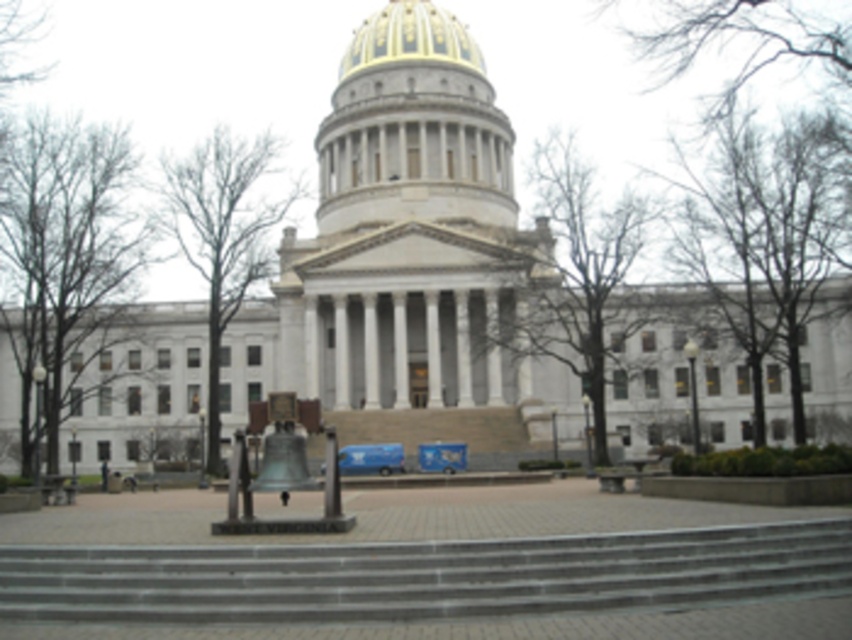
Which is in front, point (214, 179) or point (1, 76)?

Point (214, 179)

Is the position of green leafless tree at center more distant than that of smooth brown bark at left?

That is False.

What are the coordinates of `green leafless tree at center` in the screenshot? It's located at (223, 236).

Find the location of `green leafless tree at center`. green leafless tree at center is located at coordinates (223, 236).

Does brown leafless tree at left appear on the left side of green leafless tree at center?

Correct, you'll find brown leafless tree at left to the left of green leafless tree at center.

What are the coordinates of `brown leafless tree at left` in the screenshot? It's located at (64, 259).

What are the coordinates of `brown leafless tree at left` in the screenshot? It's located at (64, 259).

Can you confirm if gray concrete stairs at center is thinner than smooth brown bark at left?

Incorrect, gray concrete stairs at center's width is not less than smooth brown bark at left's.

Who is lower down, gray concrete stairs at center or smooth brown bark at left?

gray concrete stairs at center is below.

What are the coordinates of `gray concrete stairs at center` in the screenshot? It's located at (424, 576).

The width and height of the screenshot is (852, 640). I want to click on gray concrete stairs at center, so click(x=424, y=576).